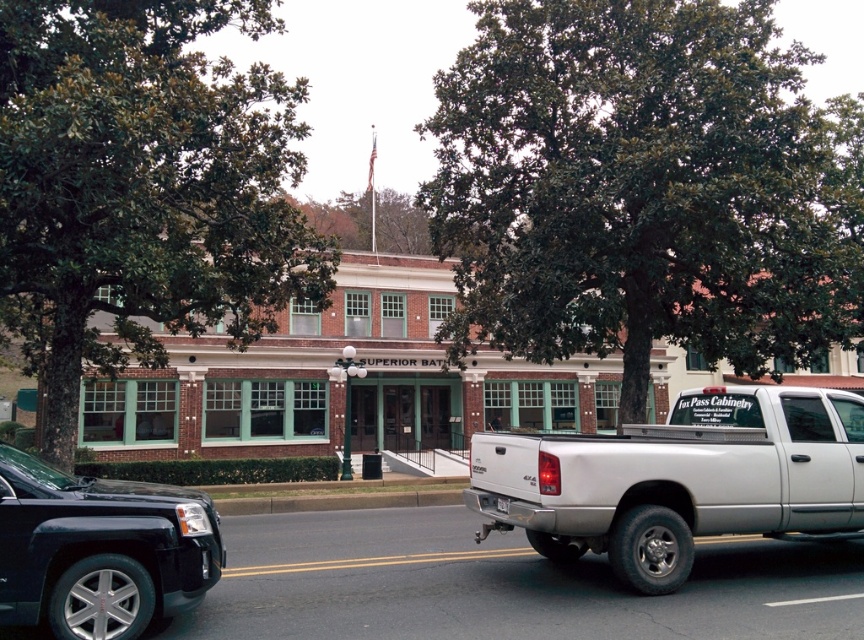
Looking at this image, is green leafy tree at upper left below silver metallic truck at right?

Incorrect, green leafy tree at upper left is not positioned below silver metallic truck at right.

Find the location of a particular element. green leafy tree at upper left is located at coordinates (143, 188).

Between point (43, 173) and point (601, 548), which one is positioned behind?

Positioned behind is point (43, 173).

In order to click on green leafy tree at upper left in this screenshot , I will do `click(143, 188)`.

Can you confirm if shiny black suv at left is positioned to the right of white plastic license plate at rear?

Incorrect, shiny black suv at left is not on the right side of white plastic license plate at rear.

Can you confirm if shiny black suv at left is positioned to the left of white plastic license plate at rear?

Yes, shiny black suv at left is to the left of white plastic license plate at rear.

What are the coordinates of `shiny black suv at left` in the screenshot? It's located at (99, 548).

The width and height of the screenshot is (864, 640). Find the location of `shiny black suv at left`. shiny black suv at left is located at coordinates (99, 548).

Is green leafy tree at center bigger than green leafy tree at upper left?

Yes.

Between green leafy tree at center and green leafy tree at upper left, which one is positioned higher?

green leafy tree at center

Who is more forward, (580, 120) or (30, 131)?

Point (30, 131)

At what (x,y) coordinates should I click in order to perform the action: click on green leafy tree at center. Please return your answer as a coordinate pair (x, y). Looking at the image, I should click on (643, 188).